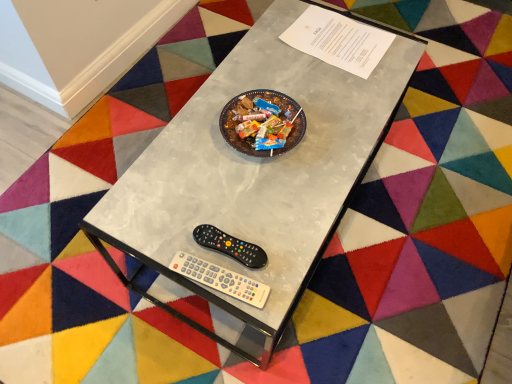
Where is `black plastic remote at lower center`? black plastic remote at lower center is located at coordinates (230, 246).

Find the location of a particular element. The height and width of the screenshot is (384, 512). white plastic wii controller at lower center is located at coordinates (221, 279).

Where is `metallic gray table at center`? This screenshot has height=384, width=512. metallic gray table at center is located at coordinates (256, 174).

The width and height of the screenshot is (512, 384). What are the coordinates of `black plastic remote at lower center` in the screenshot? It's located at (230, 246).

Is white plastic wii controller at lower center thinner than metallic gray table at center?

Yes.

From the image's perspective, which one is positioned higher, white plastic wii controller at lower center or metallic gray table at center?

metallic gray table at center is shown above in the image.

Is metallic gray table at center inside white plastic wii controller at lower center?

No, metallic gray table at center is not a part of white plastic wii controller at lower center.

Is white plastic wii controller at lower center to the left of metallic gray table at center from the viewer's perspective?

Yes.

From the image's perspective, does black plastic remote at lower center appear higher than metallic gray table at center?

No, from the image's perspective, black plastic remote at lower center is not on top of metallic gray table at center.

From a real-world perspective, which object rests below the other?

metallic gray table at center, from a real-world perspective.

Which object is further away from the camera taking this photo, black plastic remote at lower center or metallic gray table at center?

Positioned behind is black plastic remote at lower center.

Is metallic gray table at center at the back of black plastic remote at lower center?

Yes.

Does point (238, 256) come closer to viewer compared to point (234, 297)?

No, it is behind (234, 297).

From the image's perspective, is black plastic remote at lower center positioned above or below white plastic wii controller at lower center?

From the image's perspective, black plastic remote at lower center appears above white plastic wii controller at lower center.

From the picture: Which of these two, black plastic remote at lower center or white plastic wii controller at lower center, is bigger?

black plastic remote at lower center.

Does metallic gray table at center contain black plastic remote at lower center?

Yes, black plastic remote at lower center is a part of metallic gray table at center.

From a real-world perspective, is metallic gray table at center above or below black plastic remote at lower center?

Clearly, from a real-world perspective, metallic gray table at center is below black plastic remote at lower center.

How far apart are metallic gray table at center and black plastic remote at lower center?

metallic gray table at center is 13.27 inches away from black plastic remote at lower center.

Considering the relative sizes of metallic gray table at center and white plastic wii controller at lower center in the image provided, is metallic gray table at center bigger than white plastic wii controller at lower center?

Correct, metallic gray table at center is larger in size than white plastic wii controller at lower center.

Is white plastic wii controller at lower center at the back of metallic gray table at center?

No, white plastic wii controller at lower center is not at the back of metallic gray table at center.

Does metallic gray table at center lie in front of white plastic wii controller at lower center?

Yes.

Is white plastic wii controller at lower center in front of or behind black plastic remote at lower center in the image?

In the image, white plastic wii controller at lower center appears in front of black plastic remote at lower center.

You are a GUI agent. You are given a task and a screenshot of the screen. Output one action in this format:
    pyautogui.click(x=<x>, y=<y>)
    Task: Click on the control on the right side of white plastic wii controller at lower center
    
    Given the screenshot: What is the action you would take?
    tap(230, 246)

In the scene shown: Is white plastic wii controller at lower center next to black plastic remote at lower center?

Yes, white plastic wii controller at lower center is right next to black plastic remote at lower center and making contact.

Does point (220, 278) come in front of point (222, 238)?

Yes, it is in front of point (222, 238).

What are the coordinates of `table that is in front of the white plastic wii controller at lower center` in the screenshot? It's located at (256, 174).

Where is `table on the right of the black plastic remote at lower center`? The image size is (512, 384). table on the right of the black plastic remote at lower center is located at coordinates (256, 174).

Considering their positions, is black plastic remote at lower center positioned closer to white plastic wii controller at lower center than metallic gray table at center?

Based on the image, black plastic remote at lower center appears to be nearer to white plastic wii controller at lower center.

Based on their spatial positions, is white plastic wii controller at lower center or black plastic remote at lower center closer to metallic gray table at center?

Based on the image, black plastic remote at lower center appears to be nearer to metallic gray table at center.

Based on their spatial positions, is metallic gray table at center or white plastic wii controller at lower center further from black plastic remote at lower center?

The object further to black plastic remote at lower center is metallic gray table at center.

Estimate the real-world distances between objects in this image. Which object is closer to metallic gray table at center, black plastic remote at lower center or white plastic wii controller at lower center?

The object closer to metallic gray table at center is black plastic remote at lower center.

Considering their positions, is metallic gray table at center positioned closer to white plastic wii controller at lower center than black plastic remote at lower center?

black plastic remote at lower center is positioned closer to the anchor white plastic wii controller at lower center.

Looking at the image, which one is located further to black plastic remote at lower center, white plastic wii controller at lower center or metallic gray table at center?

metallic gray table at center.

Identify the location of control between metallic gray table at center and white plastic wii controller at lower center vertically. The height and width of the screenshot is (384, 512). (230, 246).